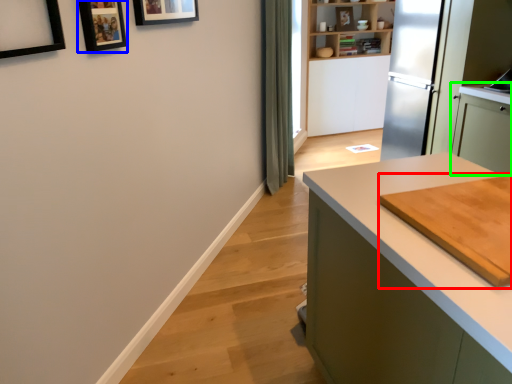
Question: Which object is the closest to the cutting board (highlighted by a red box)? Choose among these: picture frame (highlighted by a blue box) or cabinetry (highlighted by a green box).

Choices:
 (A) picture frame
 (B) cabinetry

Answer: (A)